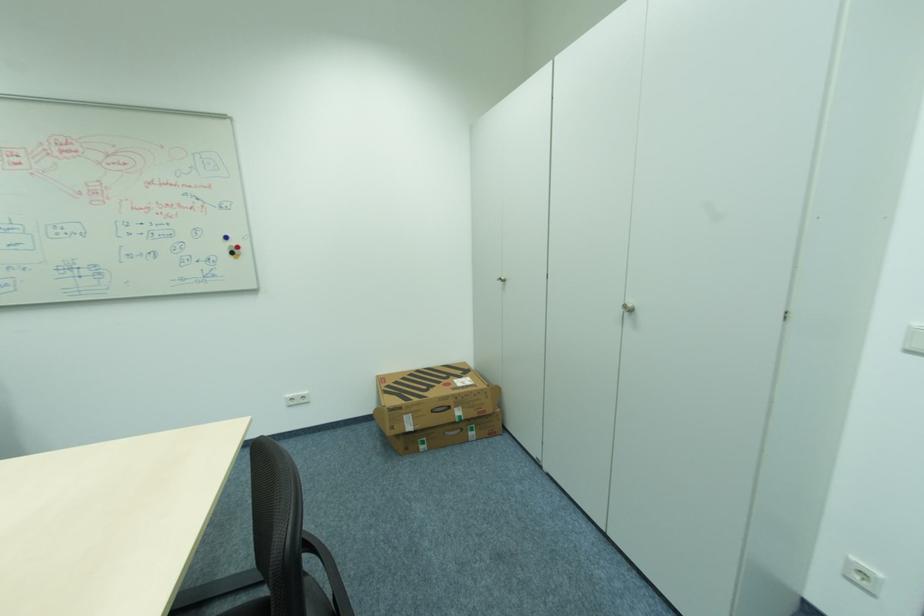
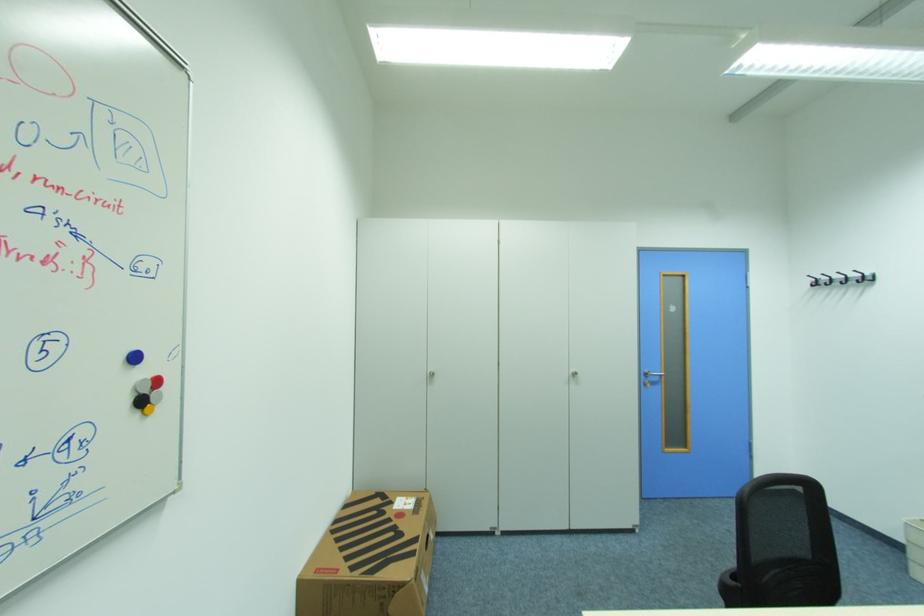
Find the pixel in the second image that matches point (466, 377) in the first image.

(396, 503)